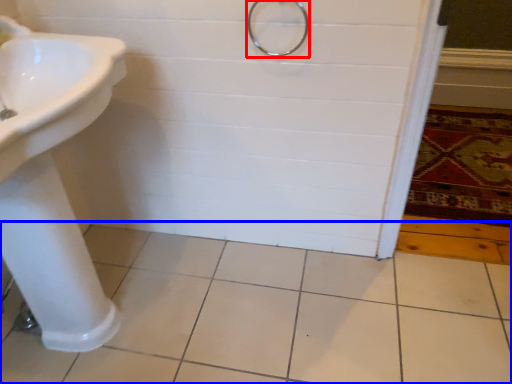
Question: Which object is further to the camera taking this photo, shower (highlighted by a red box) or ceramic tile (highlighted by a blue box)?

Choices:
 (A) shower
 (B) ceramic tile

Answer: (A)